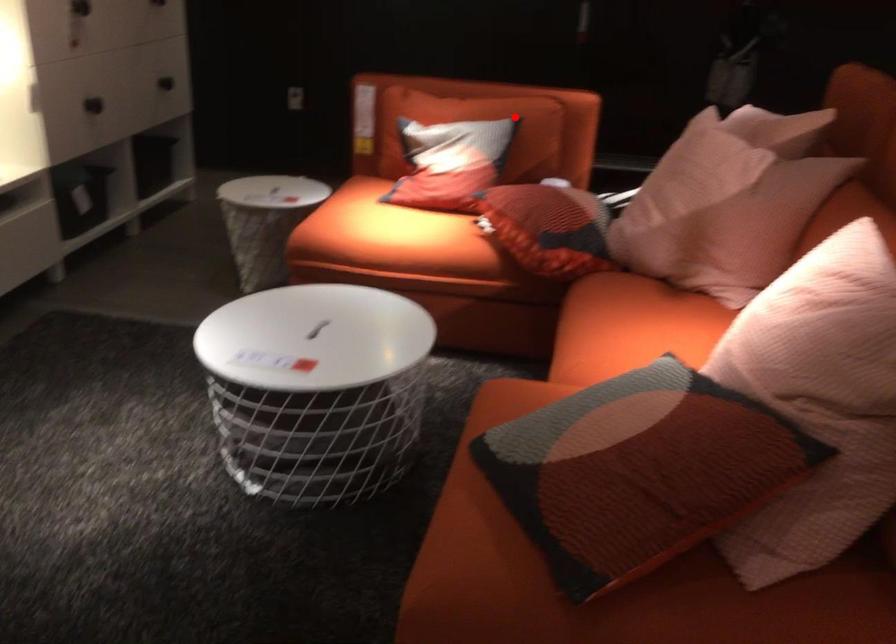
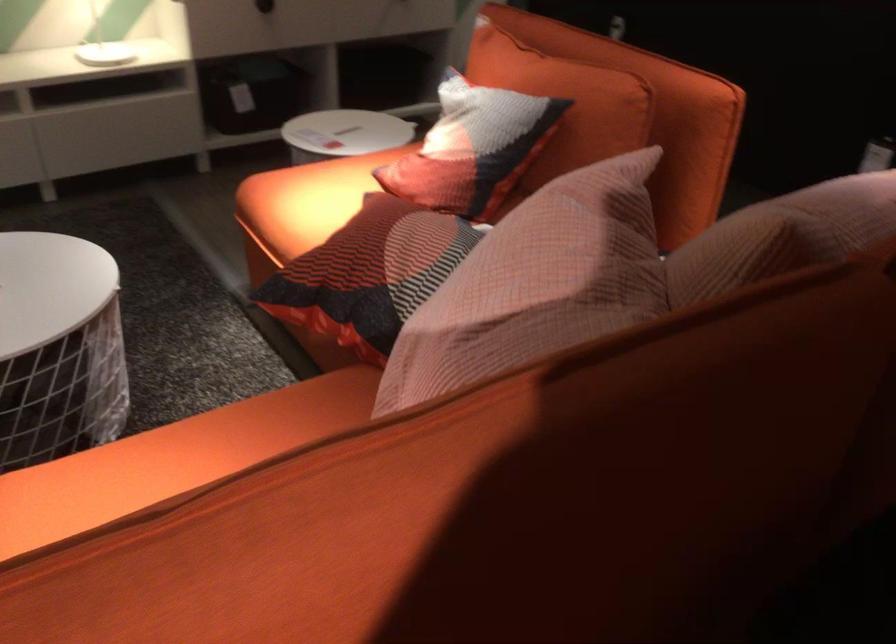
Question: A red point is marked in image1. In image2, is the corresponding 3D point closer to the camera or farther? Reply with the corresponding letter.

Choices:
 (A) The corresponding 3D point is closer.
 (B) The corresponding 3D point is farther.

Answer: (A)